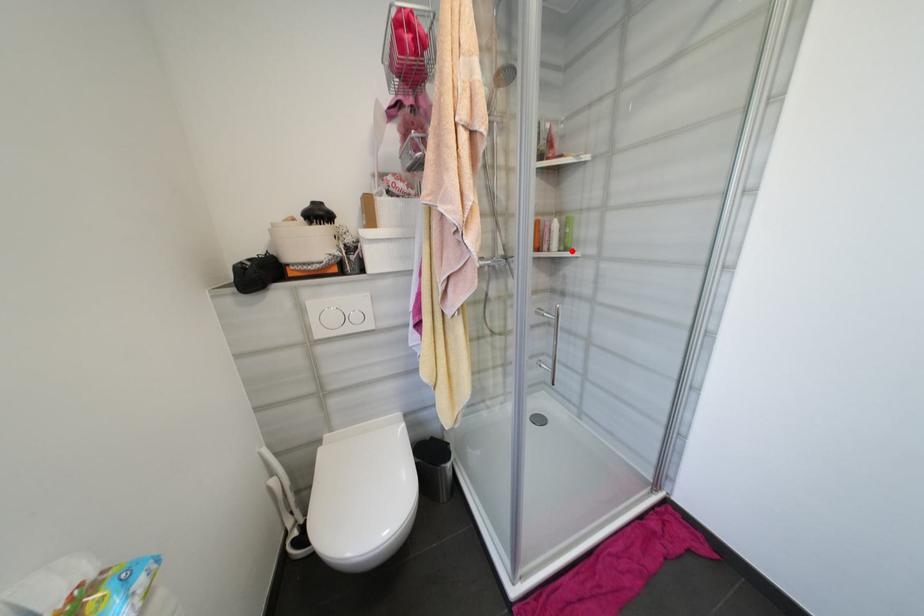
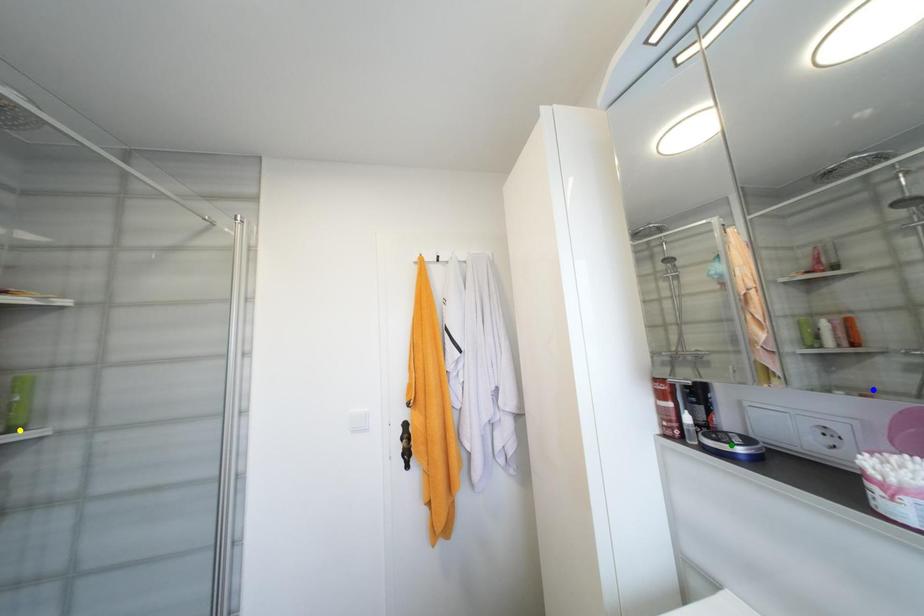
Question: I am providing you with two images of the same scene from different viewpoints. A red point is marked on the first image. You are given multiple points on the second image. Which mark in image 2 goes with the point in image 1?

Choices:
 (A) blue point
 (B) yellow point
 (C) green point

Answer: (B)